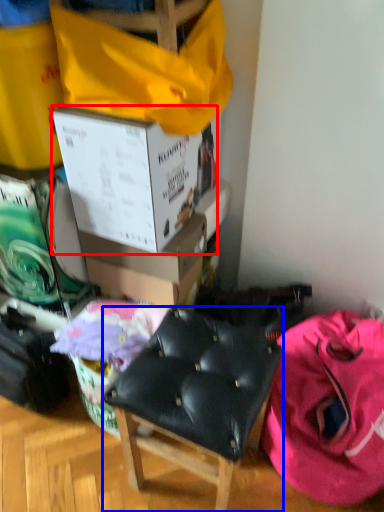
Question: Which object is closer to the camera taking this photo, box (highlighted by a red box) or chair (highlighted by a blue box)?

Choices:
 (A) box
 (B) chair

Answer: (B)